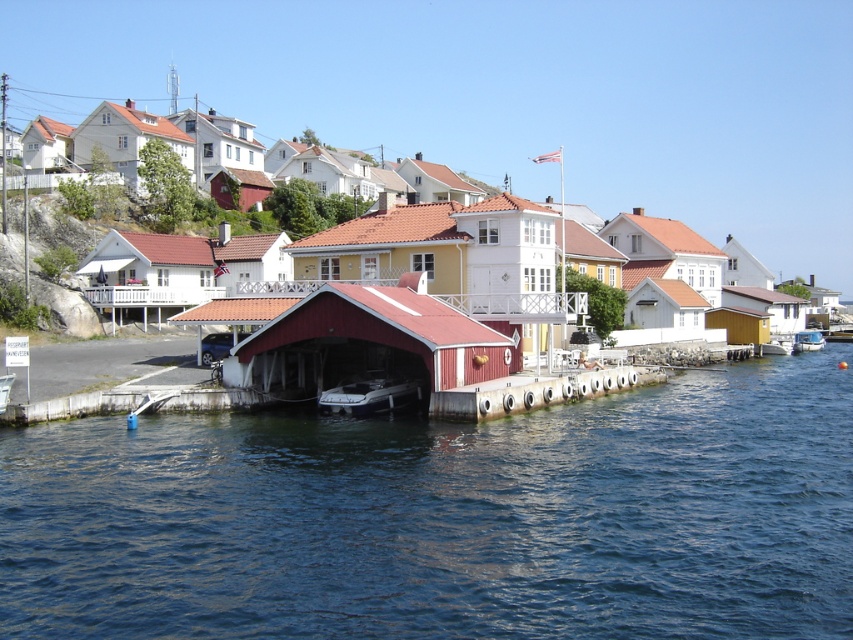
Looking at this image, which is more to the left, white wood cabin at center or yellow matte house at center?

Positioned to the left is yellow matte house at center.

Is point (665, 323) in front of point (424, 188)?

Yes, it is.

Locate an element on the screen. white wood cabin at center is located at coordinates (664, 305).

Can you confirm if white wooden house at upper center is thinner than white wooden house at upper left?

Indeed, white wooden house at upper center has a lesser width compared to white wooden house at upper left.

Is white wooden house at upper center above white wooden house at upper left?

Yes, white wooden house at upper center is above white wooden house at upper left.

Which is in front, point (103, 148) or point (39, 156)?

Point (103, 148) is more forward.

This screenshot has height=640, width=853. I want to click on white wooden house at upper center, so click(x=126, y=140).

Does point (595, 561) come in front of point (363, 412)?

Yes, it is.

Does blue water at lower center have a greater height compared to white plastic boat at center?

Yes.

Is point (253, 608) less distant than point (349, 403)?

Yes, point (253, 608) is in front of point (349, 403).

Find the location of a particular element. blue water at lower center is located at coordinates (445, 518).